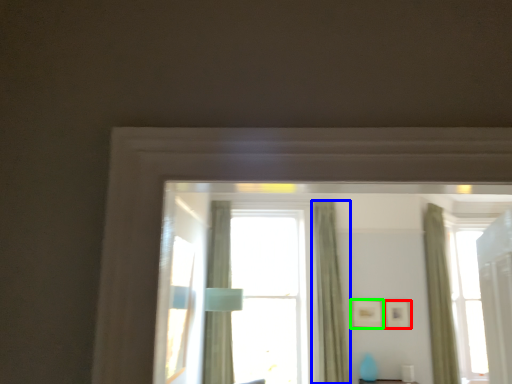
Question: Considering the real-world distances, which object is farthest from picture frame (highlighted by a red box)? curtain (highlighted by a blue box) or picture frame (highlighted by a green box)?

Choices:
 (A) curtain
 (B) picture frame

Answer: (A)